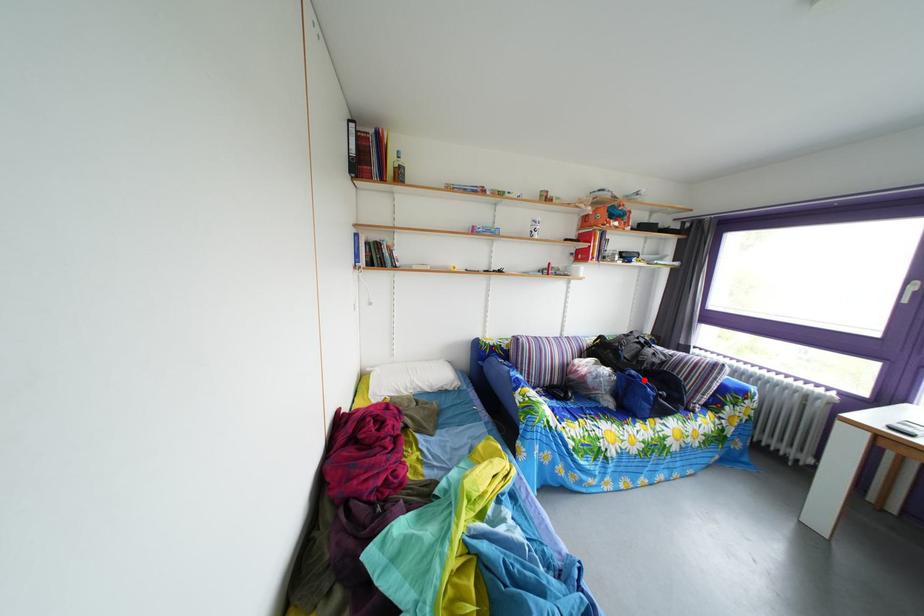
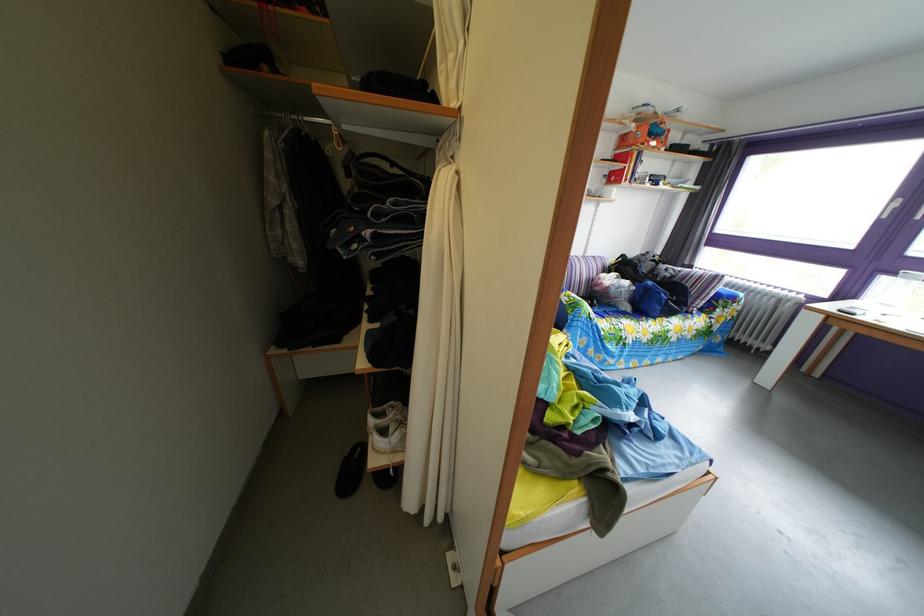
Where in the second image is the point corresponding to the highlighted location from the first image?

(661, 291)